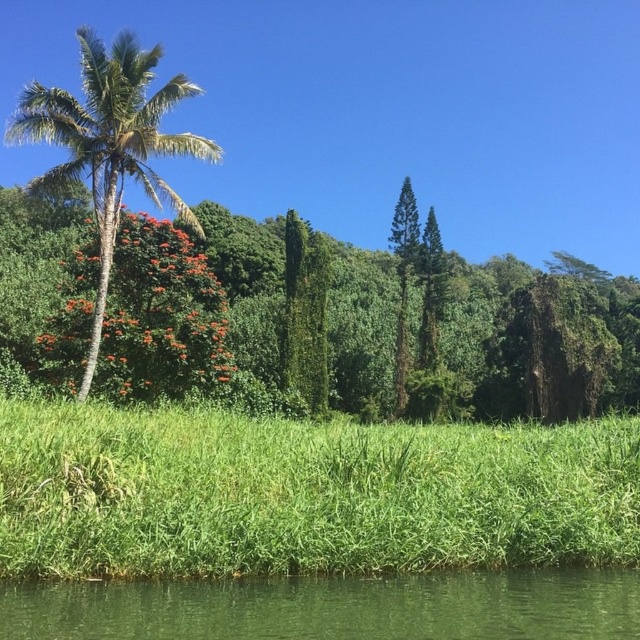
Question: Is green leafy grass at lower center further to the viewer compared to green smooth water at lower center?

Choices:
 (A) no
 (B) yes

Answer: (B)

Question: Can you confirm if green smooth water at lower center is positioned above green leafy palm tree at left?

Choices:
 (A) no
 (B) yes

Answer: (A)

Question: Estimate the real-world distances between objects in this image. Which object is closer to the green leafy grass at lower center?

Choices:
 (A) green leafy palm tree at left
 (B) green leafy tree at left
 (C) green smooth water at lower center

Answer: (C)

Question: Which point is farther to the camera?

Choices:
 (A) (100, 74)
 (B) (326, 579)
 (C) (170, 572)

Answer: (A)

Question: Does green smooth water at lower center have a smaller size compared to green leafy palm tree at left?

Choices:
 (A) yes
 (B) no

Answer: (A)

Question: Estimate the real-world distances between objects in this image. Which object is closer to the green leafy tree at left?

Choices:
 (A) green smooth water at lower center
 (B) green leafy palm tree at left
 (C) green leafy grass at lower center

Answer: (B)